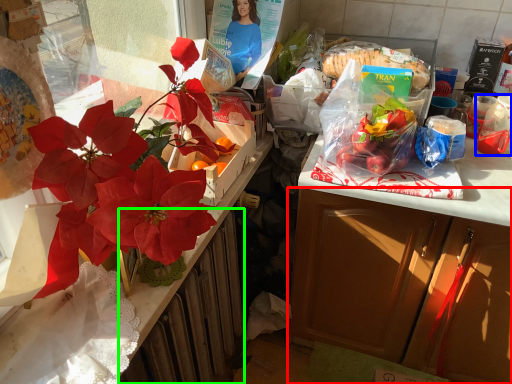
Question: Considering the real-world distances, which object is closest to cabinetry (highlighted by a red box)? coffee cup (highlighted by a blue box) or radiator (highlighted by a green box).

Choices:
 (A) coffee cup
 (B) radiator

Answer: (B)